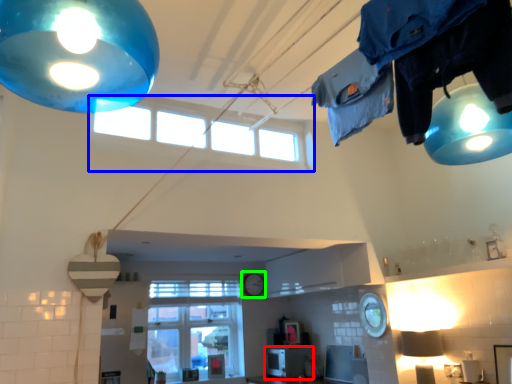
Question: Based on their relative distances, which object is nearer to appliance (highlighted by a red box)? Choose from window (highlighted by a blue box) and clock (highlighted by a green box).

Choices:
 (A) window
 (B) clock

Answer: (B)